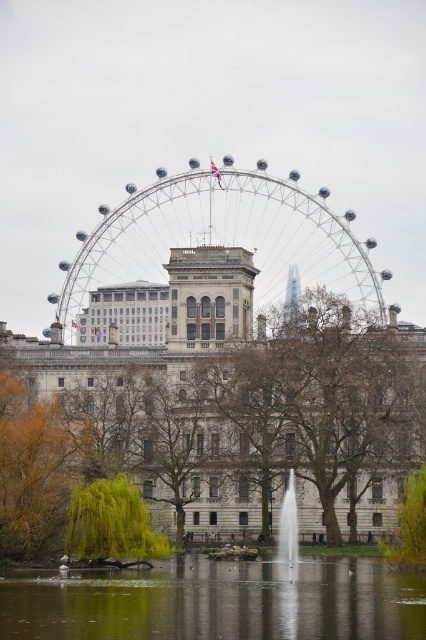
Question: Which object is closer to the camera taking this photo?

Choices:
 (A) brown leafy tree at center
 (B) green reflective water at lower center

Answer: (B)

Question: Which of the following is the farthest from the observer?

Choices:
 (A) (382, 376)
 (B) (356, 636)
 (C) (275, 468)

Answer: (A)

Question: In this image, where is brown leafy tree at center located relative to green reflective water at lower center?

Choices:
 (A) right
 (B) left

Answer: (A)

Question: Which is nearer to the clear glass fountain at center?

Choices:
 (A) metallic ferris wheel at center
 (B) brown leafy tree at center

Answer: (B)

Question: Is green reflective water at lower center above green leafy tree at lower right?

Choices:
 (A) yes
 (B) no

Answer: (B)

Question: Is golden leafy tree at lower left positioned in front of green leafy tree at lower left?

Choices:
 (A) no
 (B) yes

Answer: (A)